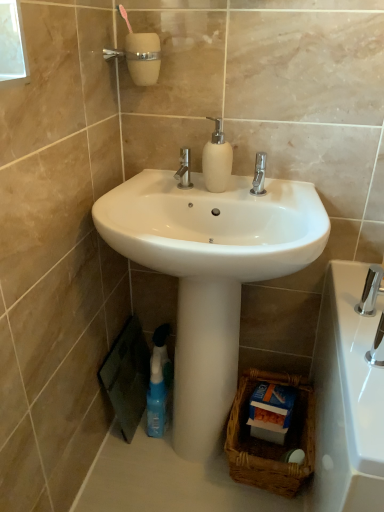
Question: From the image's perspective, is white glossy sink at center above white glossy pedestal at center?

Choices:
 (A) no
 (B) yes

Answer: (B)

Question: Is white glossy sink at center thinner than white glossy pedestal at center?

Choices:
 (A) yes
 (B) no

Answer: (B)

Question: From a real-world perspective, is white glossy sink at center on top of white glossy pedestal at center?

Choices:
 (A) yes
 (B) no

Answer: (A)

Question: Is white glossy sink at center looking in the opposite direction of white glossy pedestal at center?

Choices:
 (A) no
 (B) yes

Answer: (A)

Question: Is white glossy sink at center not near white glossy pedestal at center?

Choices:
 (A) yes
 (B) no

Answer: (B)

Question: In the image, is white glossy pedestal at center positioned in front of or behind matte white soap dispenser at center?

Choices:
 (A) behind
 (B) front

Answer: (B)

Question: Is white glossy pedestal at center situated inside matte white soap dispenser at center or outside?

Choices:
 (A) inside
 (B) outside

Answer: (B)

Question: Considering the positions of point (182, 349) and point (205, 166), is point (182, 349) closer or farther from the camera than point (205, 166)?

Choices:
 (A) closer
 (B) farther

Answer: (B)

Question: Considering the positions of white glossy pedestal at center and matte white soap dispenser at center in the image, is white glossy pedestal at center wider or thinner than matte white soap dispenser at center?

Choices:
 (A) wide
 (B) thin

Answer: (A)

Question: From a real-world perspective, relative to white glossy pedestal at center, is polished chrome faucet at lower right vertically above or below?

Choices:
 (A) above
 (B) below

Answer: (A)

Question: Based on their sizes in the image, would you say polished chrome faucet at lower right is bigger or smaller than white glossy pedestal at center?

Choices:
 (A) small
 (B) big

Answer: (A)

Question: From the image's perspective, is polished chrome faucet at lower right located above or below white glossy pedestal at center?

Choices:
 (A) below
 (B) above

Answer: (B)

Question: Considering their positions, is polished chrome faucet at lower right located in front of or behind white glossy pedestal at center?

Choices:
 (A) behind
 (B) front

Answer: (B)

Question: Is matte white soap dispenser at center wider or thinner than polished chrome faucet at lower right?

Choices:
 (A) thin
 (B) wide

Answer: (A)

Question: Is matte white soap dispenser at center to the left or to the right of polished chrome faucet at lower right in the image?

Choices:
 (A) right
 (B) left

Answer: (B)